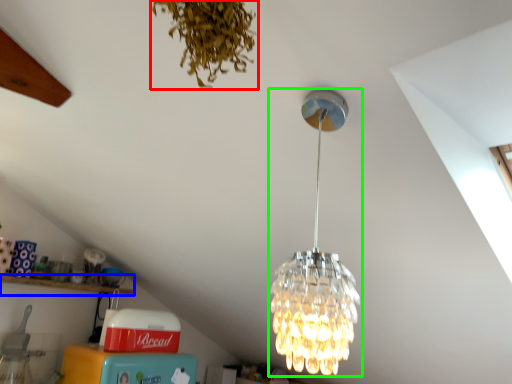
Question: Which object is the farthest from plant (highlighted by a red box)? Choose among these: shelf (highlighted by a blue box) or lamp (highlighted by a green box).

Choices:
 (A) shelf
 (B) lamp

Answer: (A)